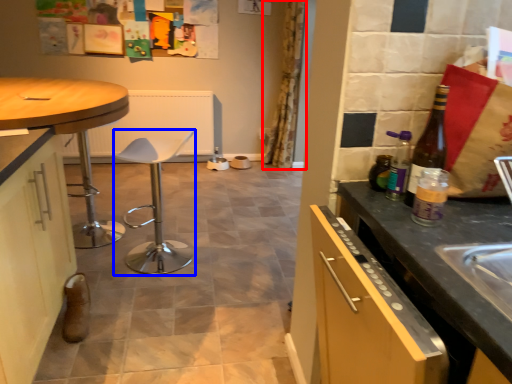
Question: Which point is closer to the camera, curtain (highlighted by a red box) or bar stool (highlighted by a blue box)?

Choices:
 (A) curtain
 (B) bar stool

Answer: (B)